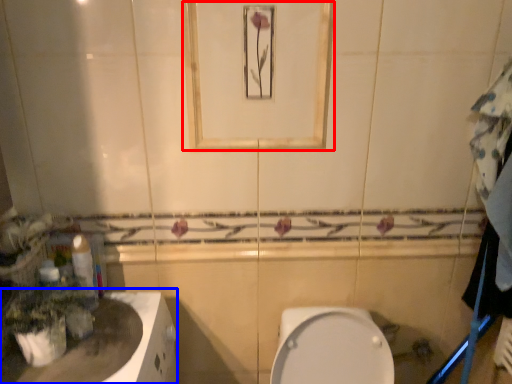
Question: Among these objects, which one is nearest to the camera, mirror (highlighted by a red box) or counter top (highlighted by a blue box)?

Choices:
 (A) mirror
 (B) counter top

Answer: (B)